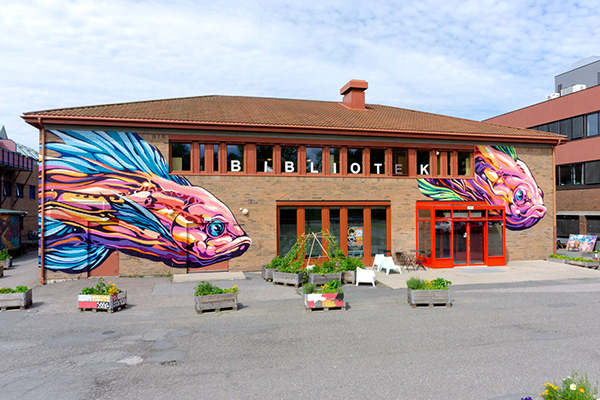
I want to click on bibliotek, so click(260, 168).